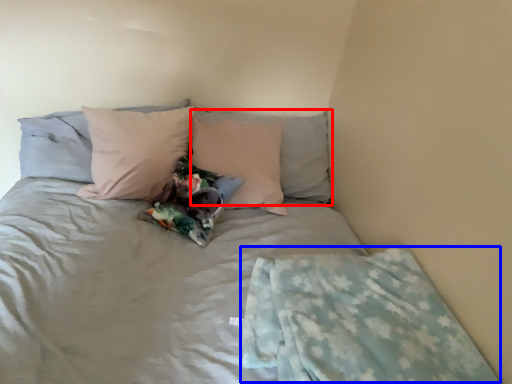
Question: Which point is closer to the camera, pillow (highlighted by a red box) or blanket (highlighted by a blue box)?

Choices:
 (A) pillow
 (B) blanket

Answer: (B)